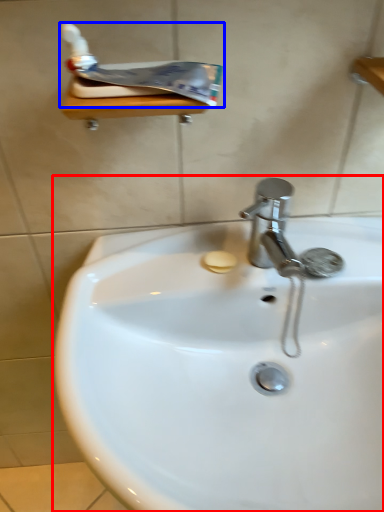
Question: Which point is further to the camera, sink (highlighted by a red box) or toothpaste (highlighted by a blue box)?

Choices:
 (A) sink
 (B) toothpaste

Answer: (B)